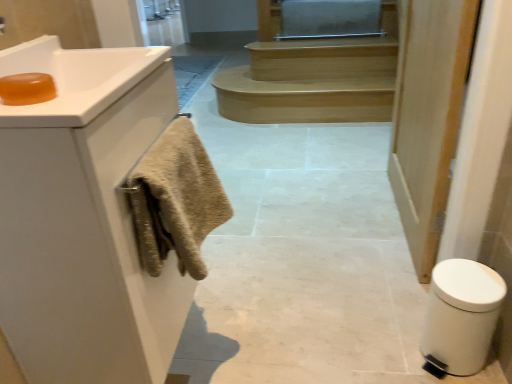
I want to click on vacant space positioned to the left of white matte door at right, so click(301, 222).